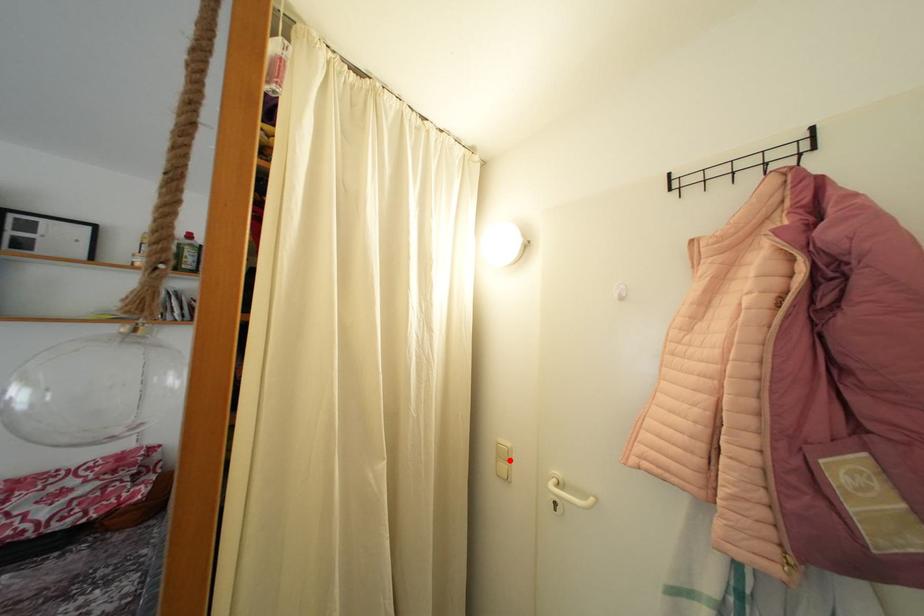
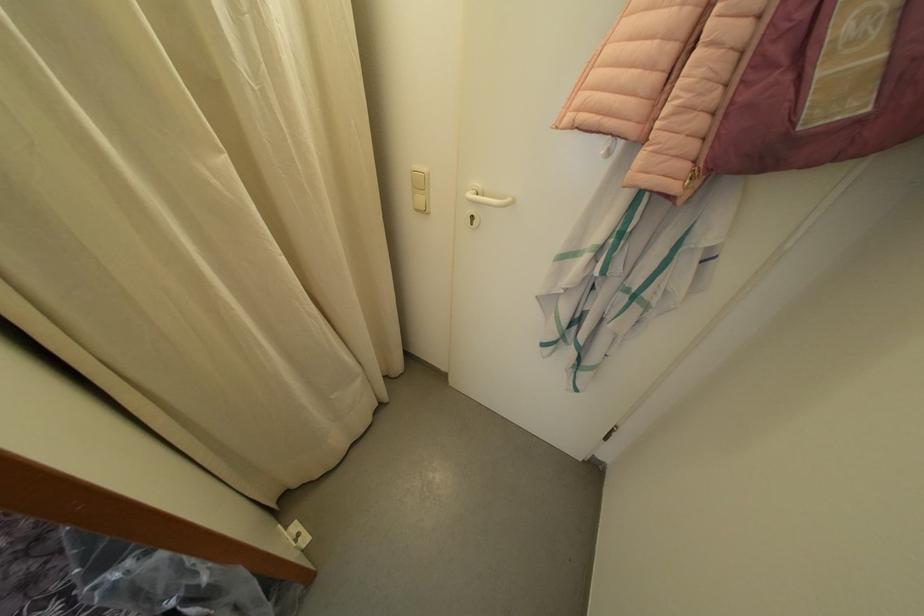
Find the pixel in the second image that matches the highlighted location in the first image.

(427, 191)